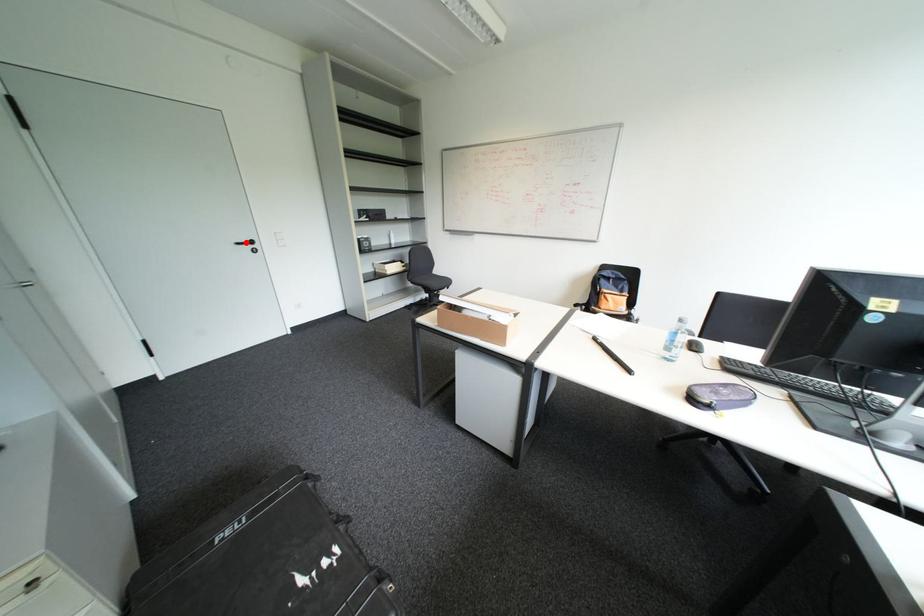
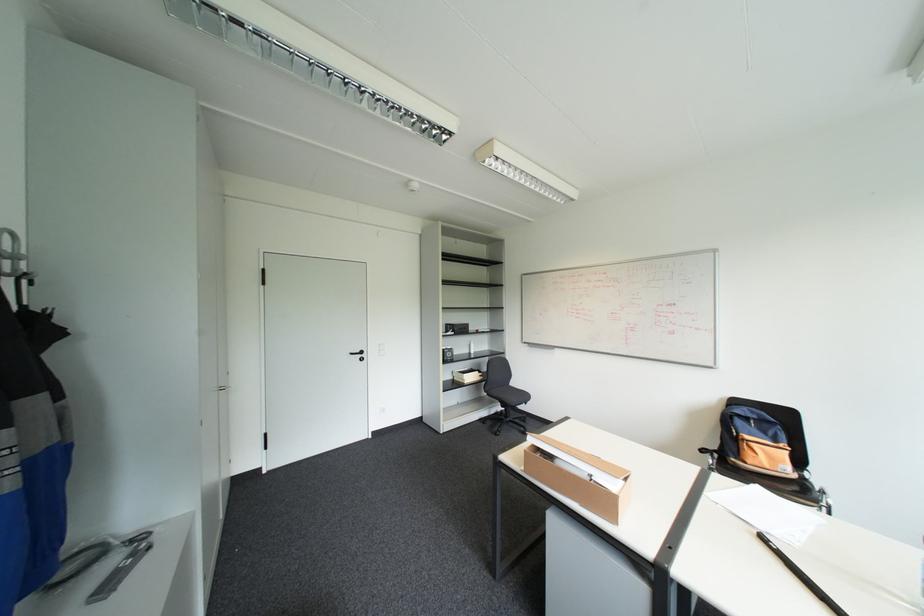
Locate, in the second image, the point that corresponds to the highlighted location in the first image.

(359, 353)